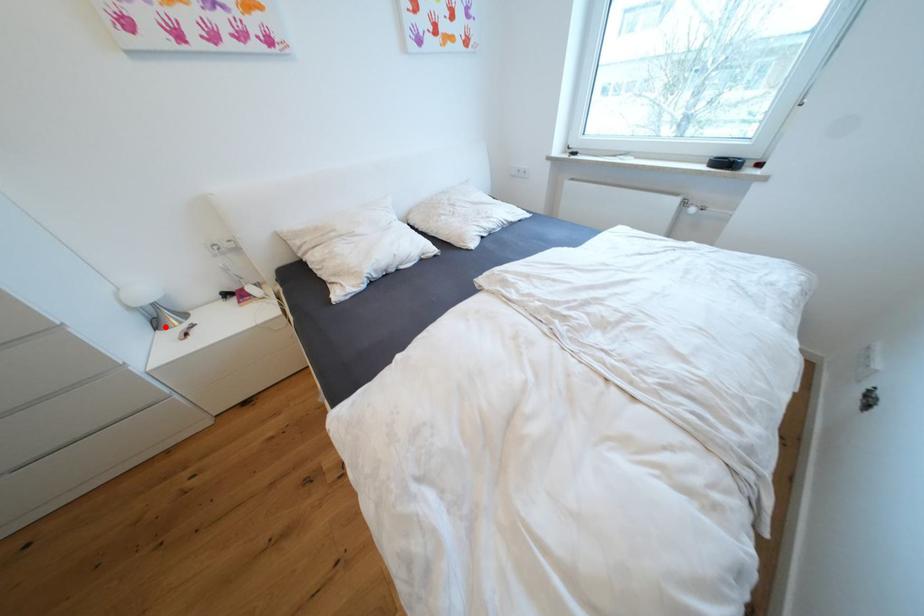
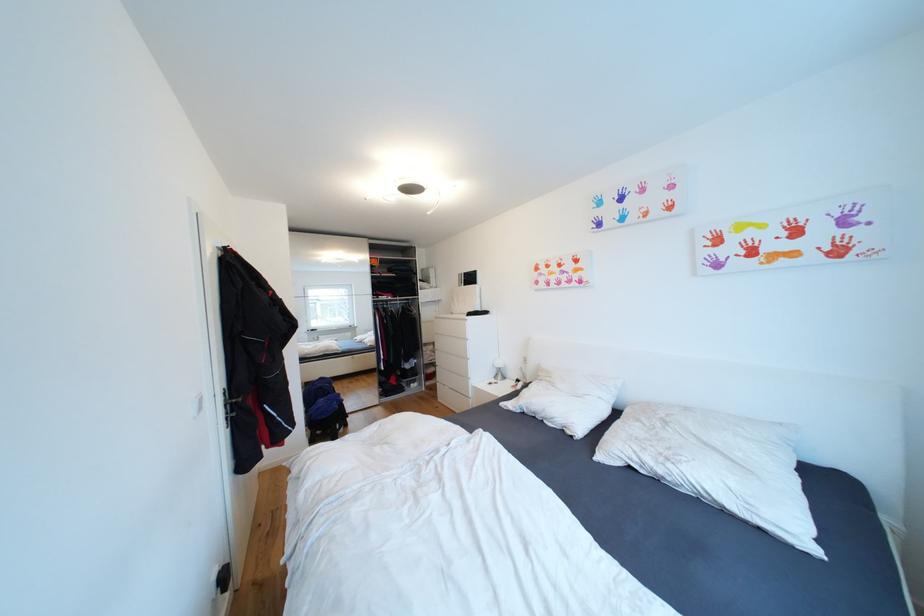
Question: I am providing you with two images of the same scene from different viewpoints. In image1, a red point is highlighted. Considering the same 3D point in image2, which of the following is correct?

Choices:
 (A) It is closer
 (B) It is farther

Answer: (B)